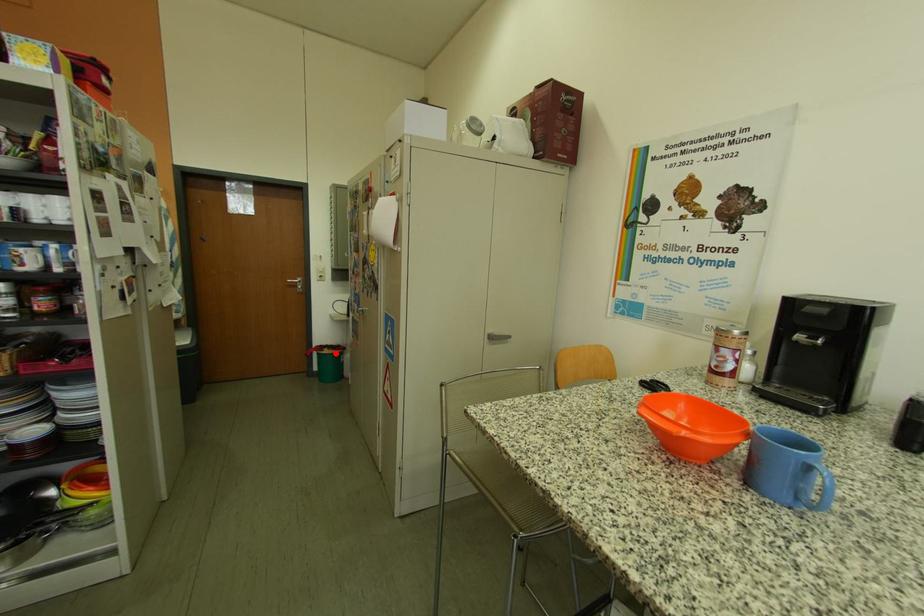
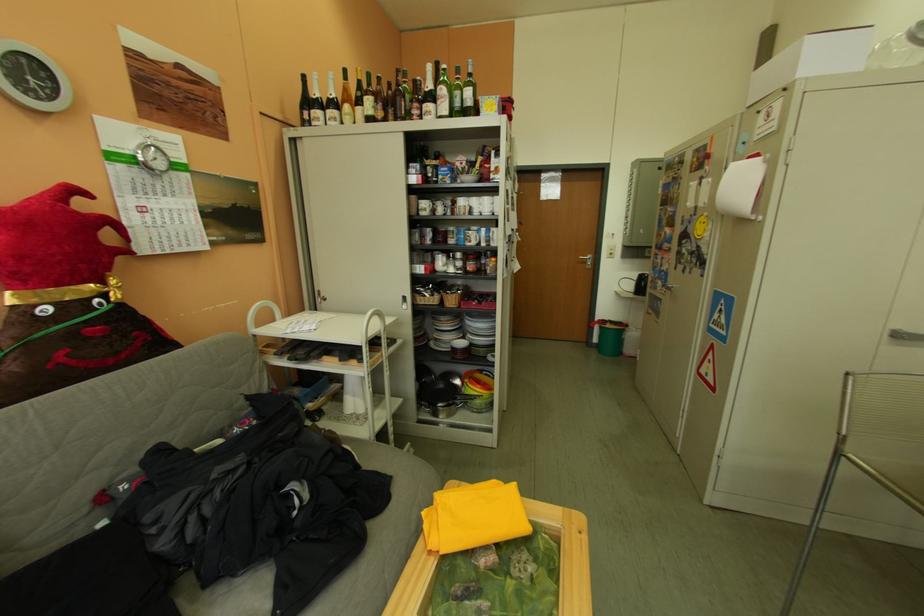
Question: I am providing you with two images of the same scene from different viewpoints. In image1, a red point is highlighted. Considering the same 3D point in image2, which of the following is correct?

Choices:
 (A) It is closer
 (B) It is farther

Answer: (A)